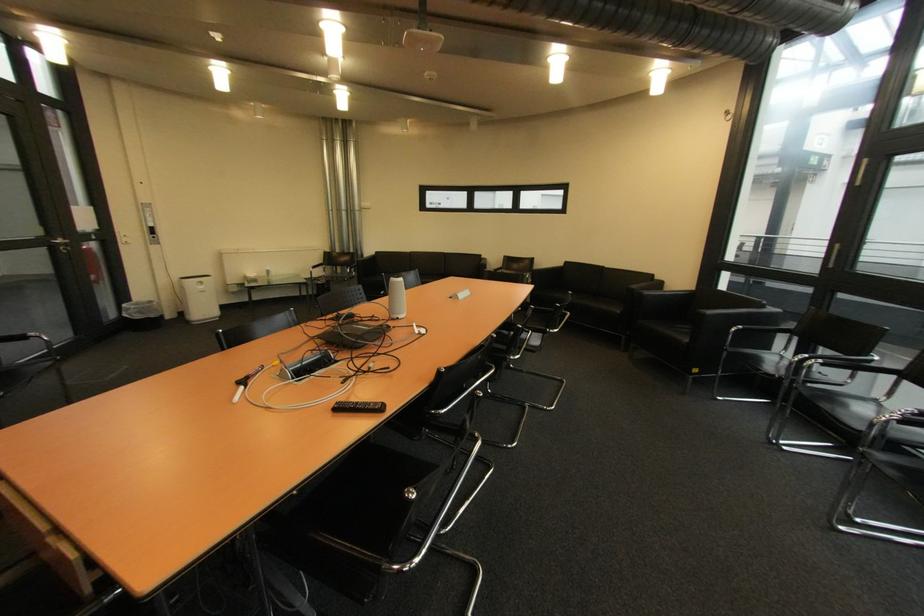
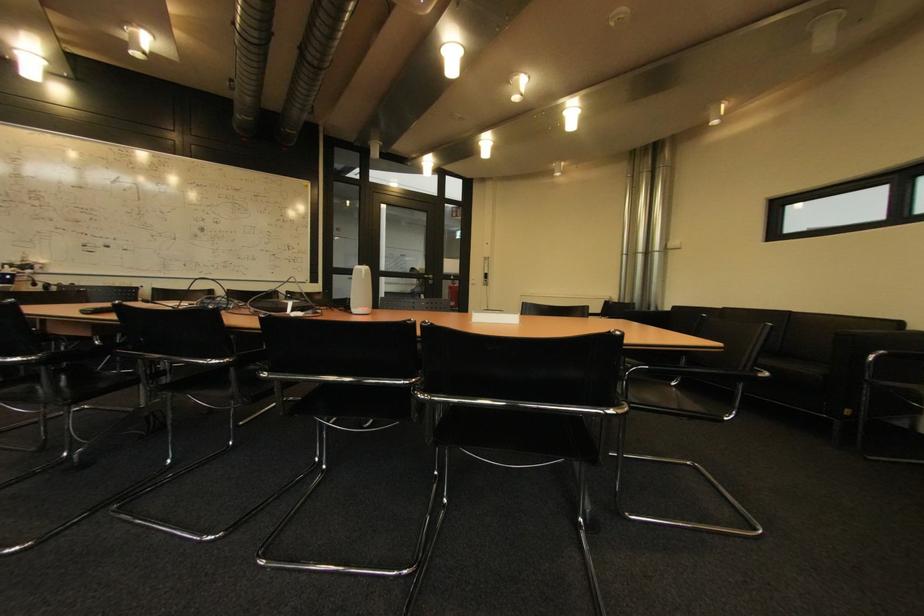
The point at (x=406, y=320) is marked in the first image. Where is the corresponding point in the second image?

(359, 314)